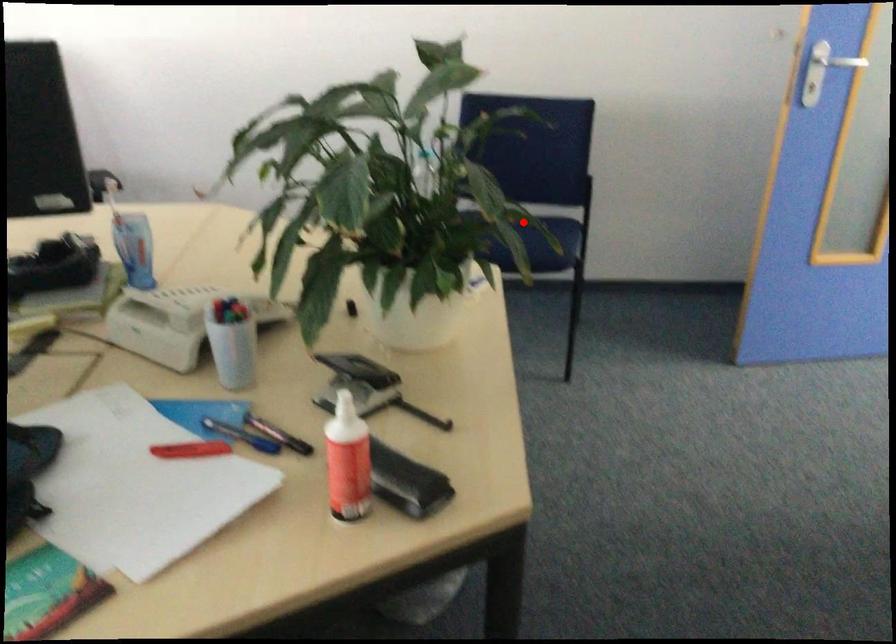
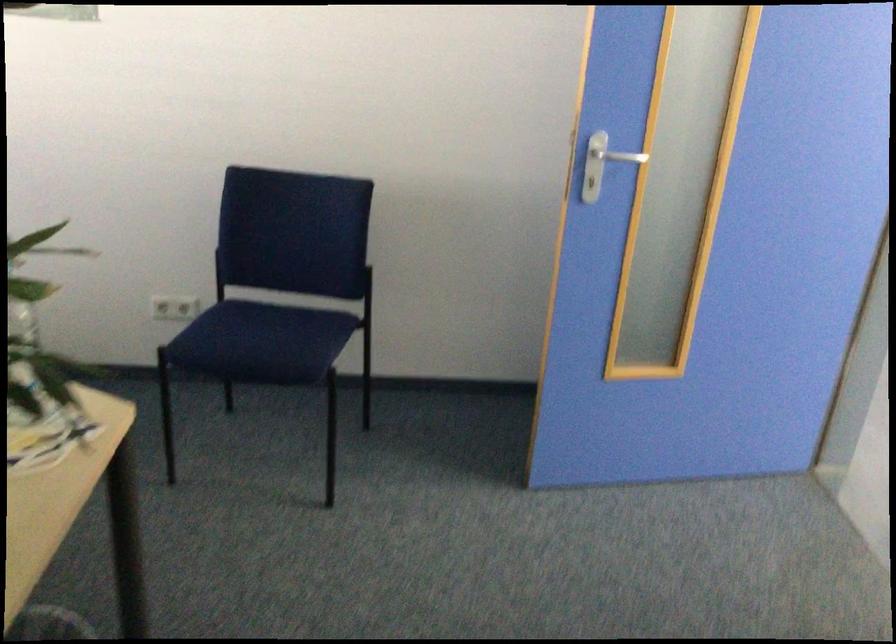
Question: I am providing you with two images of the same scene from different viewpoints. A red point is marked on the first image. At the location where the point appears in image 1, is it still visible in image 2?

Choices:
 (A) Yes
 (B) No

Answer: (A)